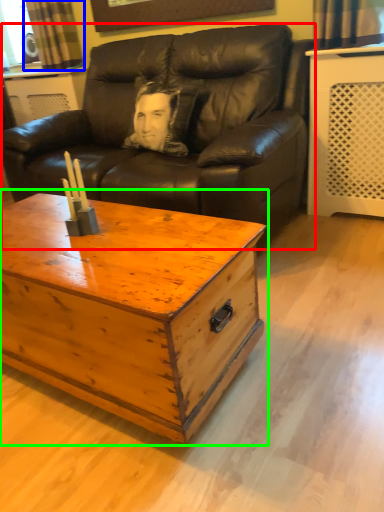
Question: Which is farther away from studio couch (highlighted by a red box)? curtain (highlighted by a blue box) or coffee table (highlighted by a green box)?

Choices:
 (A) curtain
 (B) coffee table

Answer: (A)